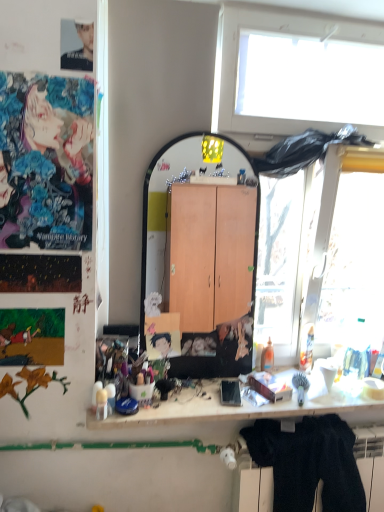
Question: Does matte black photo at upper left, placed as the 2th person when sorted from front to back, lie behind smooth black hair at center, which ranks as the 1th person in bottom-to-top order?

Choices:
 (A) no
 (B) yes

Answer: (A)

Question: Is matte black photo at upper left, which is counted as the first person, starting from the top, not near smooth black hair at center, which is counted as the 1th person, starting from the back?

Choices:
 (A) no
 (B) yes

Answer: (B)

Question: Is matte black photo at upper left, which appears as the second person when viewed from the back, in front of smooth black hair at center, positioned as the third person in left-to-right order?

Choices:
 (A) no
 (B) yes

Answer: (B)

Question: Does matte black photo at upper left, which ranks as the second person in left-to-right order, turn towards smooth black hair at center, placed as the 3th person when sorted from top to bottom?

Choices:
 (A) yes
 (B) no

Answer: (B)

Question: Does matte black photo at upper left, placed as the 2th person when sorted from front to back, have a greater height compared to smooth black hair at center, which is counted as the 1th person, starting from the back?

Choices:
 (A) no
 (B) yes

Answer: (B)

Question: Does matte black photo at upper left, which ranks as the second person in left-to-right order, have a lesser height compared to smooth black hair at center, placed as the 3th person when sorted from top to bottom?

Choices:
 (A) no
 (B) yes

Answer: (A)

Question: Can you confirm if smooth black hair at center, the 1th person in the right-to-left sequence, is shorter than matte black photo at upper left, placed as the 2th person when sorted from front to back?

Choices:
 (A) yes
 (B) no

Answer: (A)

Question: Considering the relative positions of smooth black hair at center, placed as the 3th person when sorted from top to bottom, and matte black photo at upper left, the 2th person when ordered from right to left, in the image provided, is smooth black hair at center, placed as the 3th person when sorted from top to bottom, to the left of matte black photo at upper left, the 2th person when ordered from right to left, from the viewer's perspective?

Choices:
 (A) no
 (B) yes

Answer: (A)

Question: Considering the relative sizes of smooth black hair at center, which ranks as the 1th person in bottom-to-top order, and matte black photo at upper left, which ranks as the second person in left-to-right order, in the image provided, is smooth black hair at center, which ranks as the 1th person in bottom-to-top order, taller than matte black photo at upper left, which ranks as the second person in left-to-right order,?

Choices:
 (A) yes
 (B) no

Answer: (B)

Question: From the image's perspective, is smooth black hair at center, placed as the 3th person when sorted from top to bottom, located above matte black photo at upper left, the 2th person when ordered from right to left?

Choices:
 (A) yes
 (B) no

Answer: (B)

Question: Can you confirm if smooth black hair at center, placed as the 3th person when sorted from top to bottom, is bigger than matte black photo at upper left, placed as the 2th person when sorted from front to back?

Choices:
 (A) no
 (B) yes

Answer: (B)

Question: Is smooth black hair at center, positioned as the third person in left-to-right order, further to the viewer compared to matte black photo at upper left, which ranks as the second person in left-to-right order?

Choices:
 (A) no
 (B) yes

Answer: (B)

Question: Does white matte desk at center turn towards black fuzzy sweater at lower right?

Choices:
 (A) no
 (B) yes

Answer: (A)